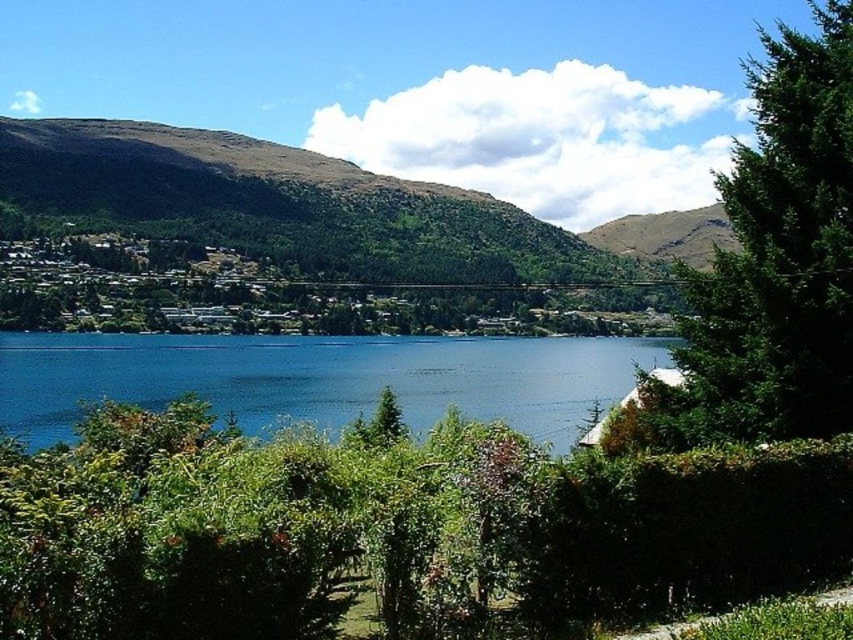
You are an environmental scientist assessing the landscape. You need to determine which object, the green leafy tree at right or the blue water at center, has a smaller width. Which one is it?

The green leafy tree at right is thinner than the blue water at center, so the green leafy tree at right has a smaller width.

You are standing at the center of the lake in the image. Which direction should you look to see the point marked at coordinates (x=776, y=260)?

The point marked at coordinates (x=776, y=260) is on a green leafy tree at right, so you should look to your right to see it.

You are standing at the edge of the lake and want to walk to the tree. Based on the image, which direction should you head towards from the blue water at center to reach the green leafy tree at right?

The green leafy tree at right is to the right of blue water at center, so you should head towards the right direction from the blue water at center to reach the green leafy tree at right.